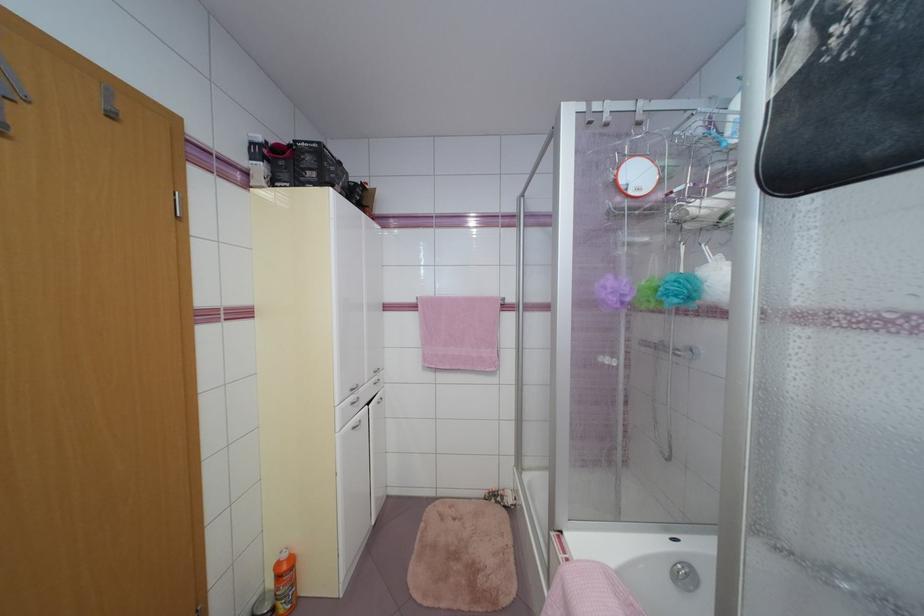
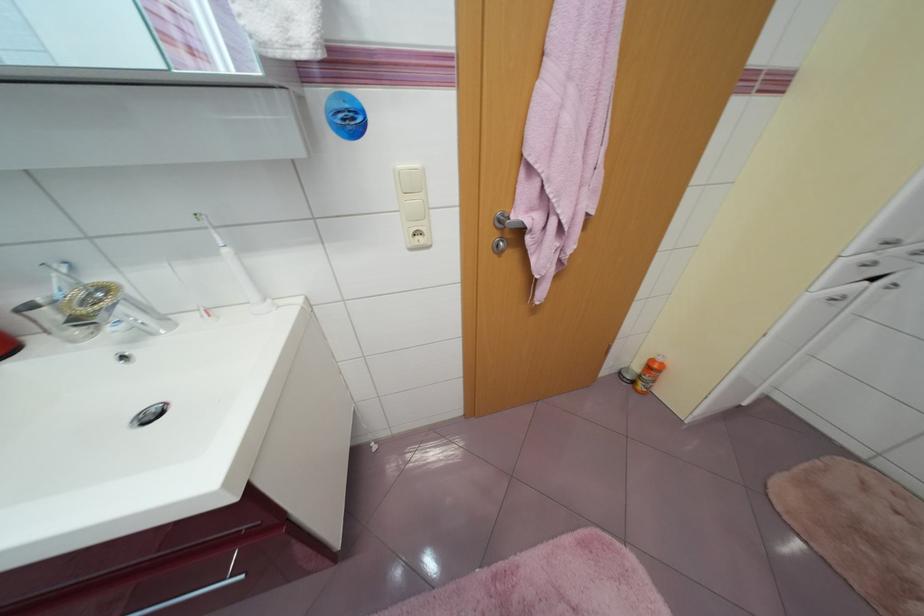
Where in the second image is the point corresponding to (x=365, y=422) from the first image?

(849, 297)